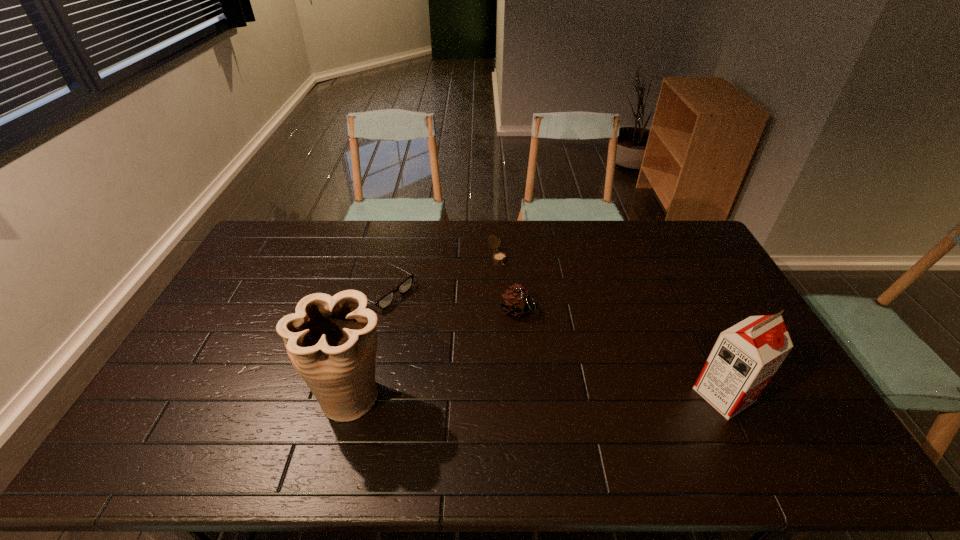
Locate an element on the screen. The height and width of the screenshot is (540, 960). vacant region located 0.110m on the front-facing side of the shortest object is located at coordinates (431, 319).

Locate an element on the screen. This screenshot has width=960, height=540. vacant space located with a leaf charm attached to the pinecone is located at coordinates (557, 363).

What are the coordinates of `vacant position located with a leaf charm attached to the pinecone` in the screenshot? It's located at (568, 380).

In order to click on vacant position located with a leaf charm attached to the pinecone in this screenshot , I will do `click(591, 411)`.

In order to click on free space located on the face of the farthest object in this screenshot , I will do `click(518, 293)`.

At what (x,y) coordinates should I click in order to perform the action: click on free region located on the face of the farthest object. Please return your answer as a coordinate pair (x, y). The image size is (960, 540). Looking at the image, I should click on [508, 276].

Find the location of `free location located on the face of the farthest object`. free location located on the face of the farthest object is located at coordinates pyautogui.click(x=531, y=310).

The height and width of the screenshot is (540, 960). I want to click on object located at the far edge, so click(x=499, y=257).

Locate an element on the screen. The height and width of the screenshot is (540, 960). urn that is at the near edge is located at coordinates (331, 341).

Where is `soya milk that is at the near edge`? This screenshot has width=960, height=540. soya milk that is at the near edge is located at coordinates (745, 357).